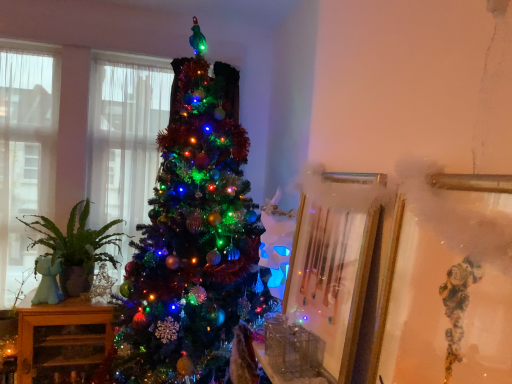
Describe the element at coordinates (62, 341) in the screenshot. I see `wooden cabinet at left` at that location.

What do you see at coordinates (125, 136) in the screenshot? Image resolution: width=512 pixels, height=384 pixels. I see `translucent fabric window at left, marked as the 2th window in a left-to-right arrangement` at bounding box center [125, 136].

In order to face shiny green tinsel at center, should I rotate leftwards or rightwards?

Turn left approximately 8.587 degrees to face it.

Describe the element at coordinates (449, 282) in the screenshot. I see `gold metallic picture frame at right, which ranks as the 2th picture frame in back-to-front order` at that location.

You are a GUI agent. You are given a task and a screenshot of the screen. Output one action in this format:
    pyautogui.click(x=<x>, y=<y>)
    Task: Click on the clear glass window at left, acting as the 2th window starting from the right
    
    Given the screenshot: What is the action you would take?
    pyautogui.click(x=25, y=156)

Considering the positions of objects gold metallic picture frame at center-right, the 2th picture frame when ordered from front to back, and wooden cabinet at left in the image provided, who is behind, gold metallic picture frame at center-right, the 2th picture frame when ordered from front to back, or wooden cabinet at left?

wooden cabinet at left is more distant.

Is gold metallic picture frame at center-right, which is the 1th picture frame from back to front, positioned with its back to wooden cabinet at left?

No, wooden cabinet at left is not at the back of gold metallic picture frame at center-right, which is the 1th picture frame from back to front.

From the wooden cabinet at left, count 1st picture frame to the right and point to it. Please provide its 2D coordinates.

[(334, 260)]

What's the angular difference between gold metallic picture frame at center-right, which is the 1th picture frame from back to front, and wooden cabinet at left's facing directions?

The angle between the facing direction of gold metallic picture frame at center-right, which is the 1th picture frame from back to front, and the facing direction of wooden cabinet at left is 88.4 degrees.

From the image's perspective, is green matte plant at left on top of wooden cabinet at left?

Indeed, from the image's perspective, green matte plant at left is shown above wooden cabinet at left.

Consider the image. Which object is positioned more to the left, green matte plant at left or wooden cabinet at left?

wooden cabinet at left is more to the left.

Would you say green matte plant at left is outside wooden cabinet at left?

Absolutely, green matte plant at left is external to wooden cabinet at left.

Between shiny green tinsel at center and gold metallic picture frame at right, the 1th picture frame in the front-to-back sequence, which one has smaller width?

gold metallic picture frame at right, the 1th picture frame in the front-to-back sequence, is thinner.

Does point (222, 315) lie behind point (461, 281)?

Yes, point (222, 315) is farther from viewer.

Considering the relative sizes of shiny green tinsel at center and gold metallic picture frame at right, which ranks as the 2th picture frame in back-to-front order, in the image provided, is shiny green tinsel at center shorter than gold metallic picture frame at right, which ranks as the 2th picture frame in back-to-front order,?

Incorrect, the height of shiny green tinsel at center does not fall short of that of gold metallic picture frame at right, which ranks as the 2th picture frame in back-to-front order.

Would you say shiny green tinsel at center is to the left or to the right of gold metallic picture frame at right, the 1th picture frame in the front-to-back sequence, in the picture?

Clearly, shiny green tinsel at center is on the left of gold metallic picture frame at right, the 1th picture frame in the front-to-back sequence, in the image.

Is green matte plant at left next to gold metallic picture frame at right, which ranks as the 2th picture frame in back-to-front order?

There is a gap between green matte plant at left and gold metallic picture frame at right, which ranks as the 2th picture frame in back-to-front order.

Is green matte plant at left behind gold metallic picture frame at right, the 1th picture frame in the front-to-back sequence?

Yes, green matte plant at left is further from the camera.

Does green matte plant at left turn towards gold metallic picture frame at right, the 1th picture frame in the front-to-back sequence?

Yes, green matte plant at left is facing gold metallic picture frame at right, the 1th picture frame in the front-to-back sequence.

Considering the relative sizes of green matte plant at left and gold metallic picture frame at right, the 1th picture frame in the front-to-back sequence, in the image provided, is green matte plant at left smaller than gold metallic picture frame at right, the 1th picture frame in the front-to-back sequence,?

Incorrect, green matte plant at left is not smaller in size than gold metallic picture frame at right, the 1th picture frame in the front-to-back sequence.

Between gold metallic picture frame at right, the 1th picture frame in the front-to-back sequence, and translucent fabric window at left, marked as the 2th window in a left-to-right arrangement, which one is positioned behind?

translucent fabric window at left, marked as the 2th window in a left-to-right arrangement, is further from the camera.

Can you confirm if gold metallic picture frame at right, which ranks as the 2th picture frame in back-to-front order, is taller than translucent fabric window at left, the 1th window positioned from the right?

No.

Is gold metallic picture frame at right, the 1th picture frame in the front-to-back sequence, spatially inside translucent fabric window at left, marked as the 2th window in a left-to-right arrangement, or outside of it?

gold metallic picture frame at right, the 1th picture frame in the front-to-back sequence, is outside translucent fabric window at left, marked as the 2th window in a left-to-right arrangement.

Which is in front, wooden cabinet at left or translucent fabric window at left, marked as the 2th window in a left-to-right arrangement?

wooden cabinet at left is more forward.

Where is `furniture in front of the translucent fabric window at left, the 1th window positioned from the right`? Image resolution: width=512 pixels, height=384 pixels. furniture in front of the translucent fabric window at left, the 1th window positioned from the right is located at coordinates (62, 341).

Could you tell me if wooden cabinet at left is facing translucent fabric window at left, the 1th window positioned from the right?

No, wooden cabinet at left is not oriented towards translucent fabric window at left, the 1th window positioned from the right.

Between wooden cabinet at left and translucent fabric window at left, the 1th window positioned from the right, which one has larger size?

wooden cabinet at left.

How many degrees apart are the facing directions of green matte plant at left and gold metallic picture frame at center-right, which is the 1th picture frame from back to front?

They differ by 89.3 degrees in their facing directions.

Considering the relative positions of green matte plant at left and gold metallic picture frame at center-right, the 2th picture frame when ordered from front to back, in the image provided, is green matte plant at left behind gold metallic picture frame at center-right, the 2th picture frame when ordered from front to back,?

That is True.

Does green matte plant at left touch gold metallic picture frame at center-right, the 2th picture frame when ordered from front to back?

No, green matte plant at left is not beside gold metallic picture frame at center-right, the 2th picture frame when ordered from front to back.

In the image, is green matte plant at left on the left side or the right side of gold metallic picture frame at center-right, which is the 1th picture frame from back to front?

green matte plant at left is to the left of gold metallic picture frame at center-right, which is the 1th picture frame from back to front.

There is a wooden cabinet at left. Where is `the 1st picture frame above it (from the image's perspective)`? This screenshot has width=512, height=384. the 1st picture frame above it (from the image's perspective) is located at coordinates (334, 260).

Locate an element on the screen. The height and width of the screenshot is (384, 512). houseplant in front of the wooden cabinet at left is located at coordinates (76, 248).

Considering their positions, is gold metallic picture frame at right, the 1th picture frame in the front-to-back sequence, positioned further to translucent fabric window at left, marked as the 2th window in a left-to-right arrangement, than green matte plant at left?

Based on the image, gold metallic picture frame at right, the 1th picture frame in the front-to-back sequence, appears to be further to translucent fabric window at left, marked as the 2th window in a left-to-right arrangement.

Estimate the real-world distances between objects in this image. Which object is further from gold metallic picture frame at right, which ranks as the 2th picture frame in back-to-front order, shiny green tinsel at center or translucent fabric window at left, the 1th window positioned from the right?

translucent fabric window at left, the 1th window positioned from the right, lies further to gold metallic picture frame at right, which ranks as the 2th picture frame in back-to-front order, than the other object.

Considering their positions, is shiny green tinsel at center positioned closer to gold metallic picture frame at center-right, the 2th picture frame when ordered from front to back, than green matte plant at left?

shiny green tinsel at center.

From the image, which object appears to be farther from gold metallic picture frame at right, the 1th picture frame in the front-to-back sequence, shiny green tinsel at center or wooden cabinet at left?

The object further to gold metallic picture frame at right, the 1th picture frame in the front-to-back sequence, is wooden cabinet at left.

Which object lies further to the anchor point wooden cabinet at left, gold metallic picture frame at center-right, the 2th picture frame when ordered from front to back, or gold metallic picture frame at right, which ranks as the 2th picture frame in back-to-front order?

gold metallic picture frame at right, which ranks as the 2th picture frame in back-to-front order.

Which object lies further to the anchor point translucent fabric window at left, the 1th window positioned from the right, wooden cabinet at left or green matte plant at left?

wooden cabinet at left is further to translucent fabric window at left, the 1th window positioned from the right.

From the image, which object appears to be nearer to gold metallic picture frame at center-right, which is the 1th picture frame from back to front, gold metallic picture frame at right, the 1th picture frame in the front-to-back sequence, or translucent fabric window at left, the 1th window positioned from the right?

The object closer to gold metallic picture frame at center-right, which is the 1th picture frame from back to front, is gold metallic picture frame at right, the 1th picture frame in the front-to-back sequence.

Estimate the real-world distances between objects in this image. Which object is closer to clear glass window at left, acting as the 2th window starting from the right, green matte plant at left or translucent fabric window at left, the 1th window positioned from the right?

translucent fabric window at left, the 1th window positioned from the right, is positioned closer to the anchor clear glass window at left, acting as the 2th window starting from the right.

The height and width of the screenshot is (384, 512). I want to click on christmas tree between green matte plant at left and gold metallic picture frame at center-right, the 2th picture frame when ordered from front to back, so click(x=193, y=239).

Where is `furniture between gold metallic picture frame at center-right, the 2th picture frame when ordered from front to back, and translucent fabric window at left, the 1th window positioned from the right, from front to back`? This screenshot has height=384, width=512. furniture between gold metallic picture frame at center-right, the 2th picture frame when ordered from front to back, and translucent fabric window at left, the 1th window positioned from the right, from front to back is located at coordinates (62, 341).

The width and height of the screenshot is (512, 384). Find the location of `christmas tree positioned between gold metallic picture frame at right, the 1th picture frame in the front-to-back sequence, and wooden cabinet at left from near to far`. christmas tree positioned between gold metallic picture frame at right, the 1th picture frame in the front-to-back sequence, and wooden cabinet at left from near to far is located at coordinates (193, 239).

Where is `houseplant between translucent fabric window at left, marked as the 2th window in a left-to-right arrangement, and wooden cabinet at left vertically`? Image resolution: width=512 pixels, height=384 pixels. houseplant between translucent fabric window at left, marked as the 2th window in a left-to-right arrangement, and wooden cabinet at left vertically is located at coordinates (76, 248).